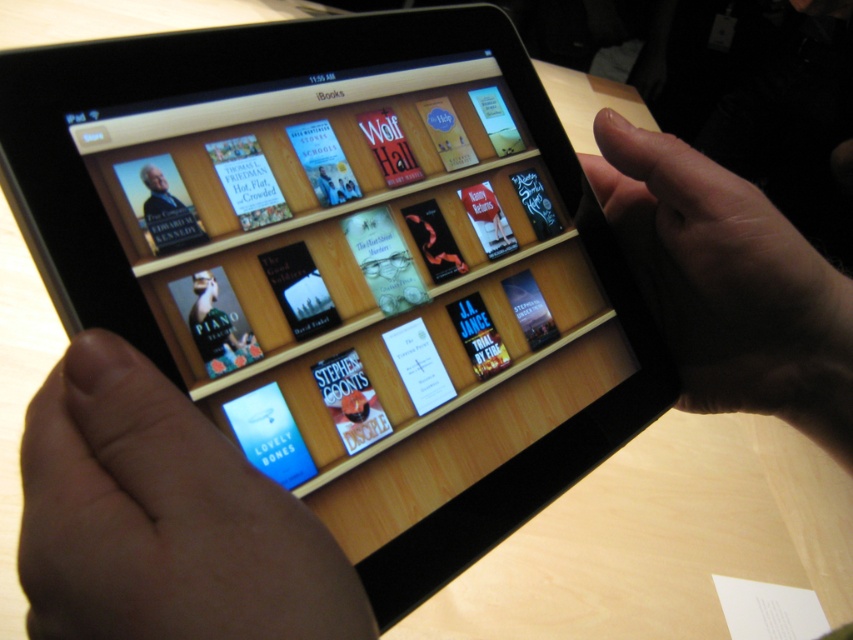
Between skinny finger at upper right and matte paper book at center, which one is positioned higher?

skinny finger at upper right is higher up.

Is skinny finger at upper right smaller than matte paper book at center?

No, skinny finger at upper right is not smaller than matte paper book at center.

Between point (811, 256) and point (229, 355), which one is positioned behind?

Positioned behind is point (811, 256).

Where is `skinny finger at upper right`? The width and height of the screenshot is (853, 640). skinny finger at upper right is located at coordinates (726, 282).

Does smooth skin hand at lower left have a larger size compared to matte paper book at center?

Yes, smooth skin hand at lower left is bigger than matte paper book at center.

Can you confirm if smooth skin hand at lower left is positioned to the right of matte paper book at center?

Indeed, smooth skin hand at lower left is positioned on the right side of matte paper book at center.

Which is in front, point (65, 592) or point (210, 321)?

Point (65, 592) is in front.

What are the coordinates of `smooth skin hand at lower left` in the screenshot? It's located at (161, 518).

Between point (100, 358) and point (727, 380), which one is positioned behind?

The point (727, 380) is behind.

Which is above, smooth skin hand at lower left or skinny finger at upper right?

skinny finger at upper right is higher up.

Which is in front, point (91, 532) or point (664, 163)?

Positioned in front is point (91, 532).

Locate an element on the screen. smooth skin hand at lower left is located at coordinates (161, 518).